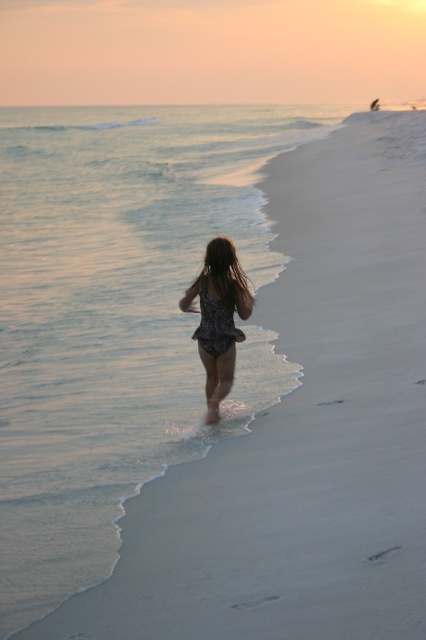
Who is lower down, sparkly sequin dress at center or brown silky hair at center?

sparkly sequin dress at center is lower down.

The image size is (426, 640). In order to click on sparkly sequin dress at center in this screenshot , I will do `click(218, 317)`.

Who is higher up, clear water at lower left or sparkly sequin dress at center?

Positioned higher is clear water at lower left.

Does clear water at lower left appear on the right side of sparkly sequin dress at center?

Incorrect, clear water at lower left is not on the right side of sparkly sequin dress at center.

Is point (16, 310) closer to camera compared to point (221, 291)?

No, (16, 310) is behind (221, 291).

The image size is (426, 640). I want to click on clear water at lower left, so click(x=118, y=317).

Is clear water at lower left to the left of brown silky hair at center from the viewer's perspective?

Yes, clear water at lower left is to the left of brown silky hair at center.

Can you confirm if clear water at lower left is bigger than brown silky hair at center?

Yes.

Find the location of a particular element. The height and width of the screenshot is (640, 426). clear water at lower left is located at coordinates (118, 317).